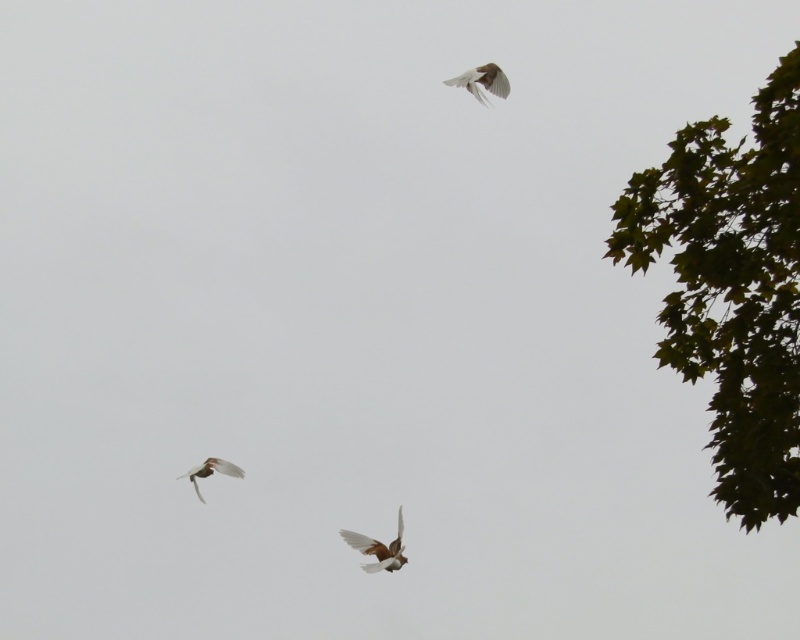
You are a birdwatcher standing in a field and see the white feathered bird at upper center. If your binoculars have a maximum range of 20 meters, can you clearly see the bird with them?

The white feathered bird at upper center is 20.86 meters away from viewer. Since the binoculars have a maximum range of 20 meters, the bird is slightly out of range, so you cannot clearly see it with them.

You are standing in the scene and want to throw a small object to the point that is closer to you. Which point should you aim for, point (738, 362) or point (377, 547)?

Point (738, 362) is in front of point (377, 547), so you should aim for point (738, 362) as it is closer to you.

You are a birdwatcher holding a telescope with a maximum range of 10 meters. You spot the green leafy tree at upper right and the brown feathered bird at center. Can your telescope clearly see both objects simultaneously?

The distance between the green leafy tree at upper right and the brown feathered bird at center is 8.41 meters. Since the telescope has a maximum range of 10 meters, it can clearly see both objects as they are within the 10 meters range.